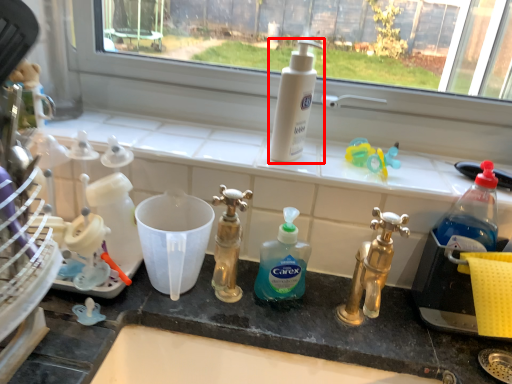
Question: From the image's perspective, what is the correct spatial relationship of cleaning product (annotated by the red box) in relation to cleaning product?

Choices:
 (A) below
 (B) above

Answer: (B)